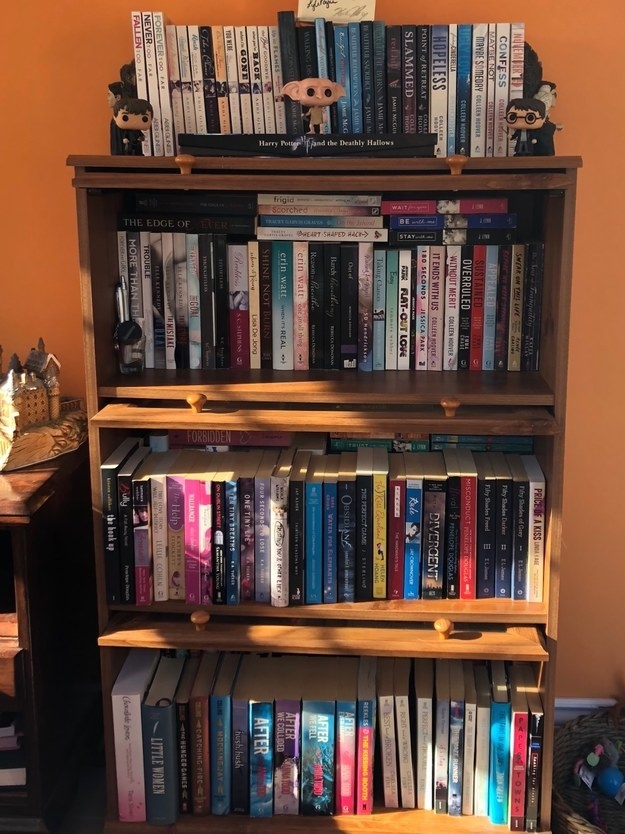
I want to click on shelf, so click(262, 392), click(271, 610), click(312, 822), click(17, 790).